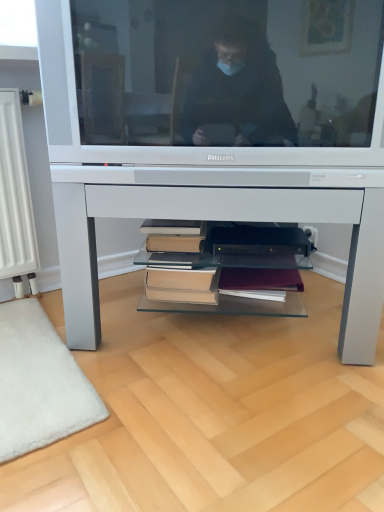
Question: Is matte silver television at center positioned far away from hardcover books at center?

Choices:
 (A) yes
 (B) no

Answer: (B)

Question: Is matte silver television at center not within hardcover books at center?

Choices:
 (A) no
 (B) yes

Answer: (B)

Question: From a real-world perspective, is matte silver television at center located higher than hardcover books at center?

Choices:
 (A) no
 (B) yes

Answer: (B)

Question: From the image's perspective, is matte silver television at center located above hardcover books at center?

Choices:
 (A) no
 (B) yes

Answer: (B)

Question: Would you say matte silver television at center contains hardcover books at center?

Choices:
 (A) yes
 (B) no

Answer: (B)

Question: Is matte silver television at center turned away from hardcover books at center?

Choices:
 (A) no
 (B) yes

Answer: (A)

Question: From the image's perspective, is matte silver television at center beneath white glossy desk at center?

Choices:
 (A) yes
 (B) no

Answer: (B)

Question: Is matte silver television at center positioned with its back to white glossy desk at center?

Choices:
 (A) no
 (B) yes

Answer: (A)

Question: Does matte silver television at center appear on the left side of white glossy desk at center?

Choices:
 (A) yes
 (B) no

Answer: (A)

Question: Is matte silver television at center taller than white glossy desk at center?

Choices:
 (A) no
 (B) yes

Answer: (A)

Question: Is matte silver television at center at the right side of white glossy desk at center?

Choices:
 (A) no
 (B) yes

Answer: (A)

Question: Is matte silver television at center wider than white glossy desk at center?

Choices:
 (A) yes
 (B) no

Answer: (B)

Question: From the image's perspective, would you say white glossy desk at center is shown under hardcover books at center?

Choices:
 (A) yes
 (B) no

Answer: (B)